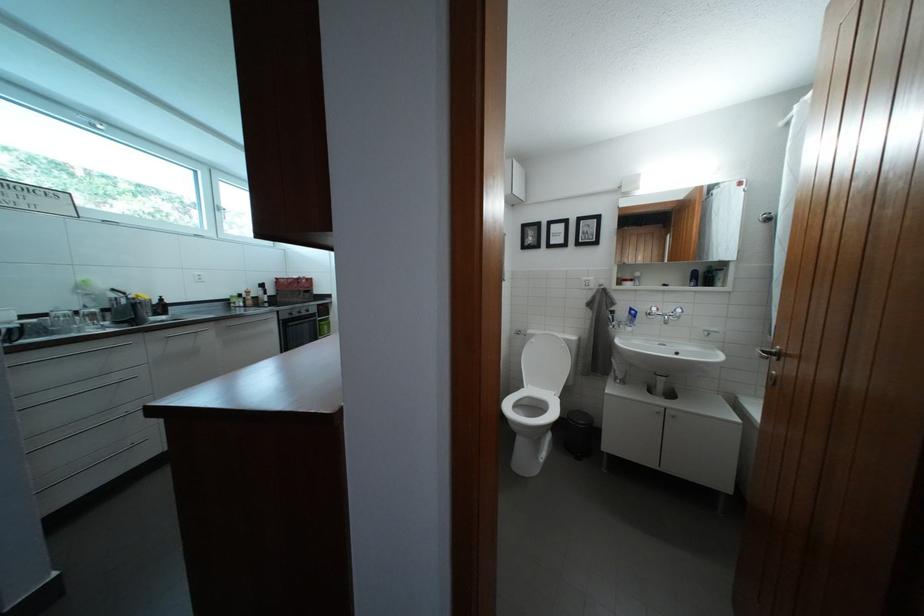
Which object does [62,321] point to?

It refers to a glass cup.